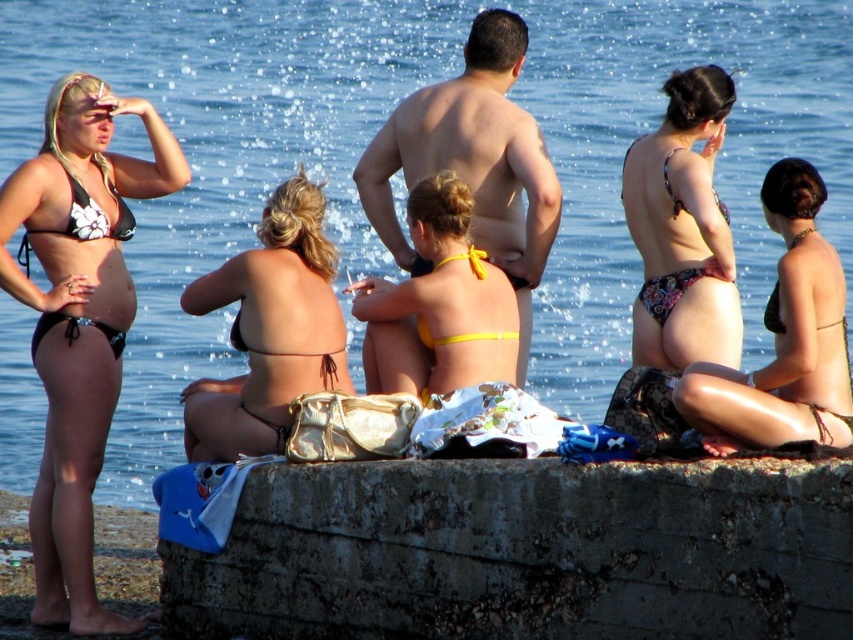
You are a photographer trying to capture a photo of the rusty concrete wall at lower center and the matte black skin at center. Since the wall is shorter than the person, how should you adjust your camera angle to ensure both are fully visible in the frame?

The rusty concrete wall at lower center is shorter than the matte black skin at center. To include both in the frame, position the camera lower so that the wall is fully visible at the bottom while still capturing the entire height of the person.